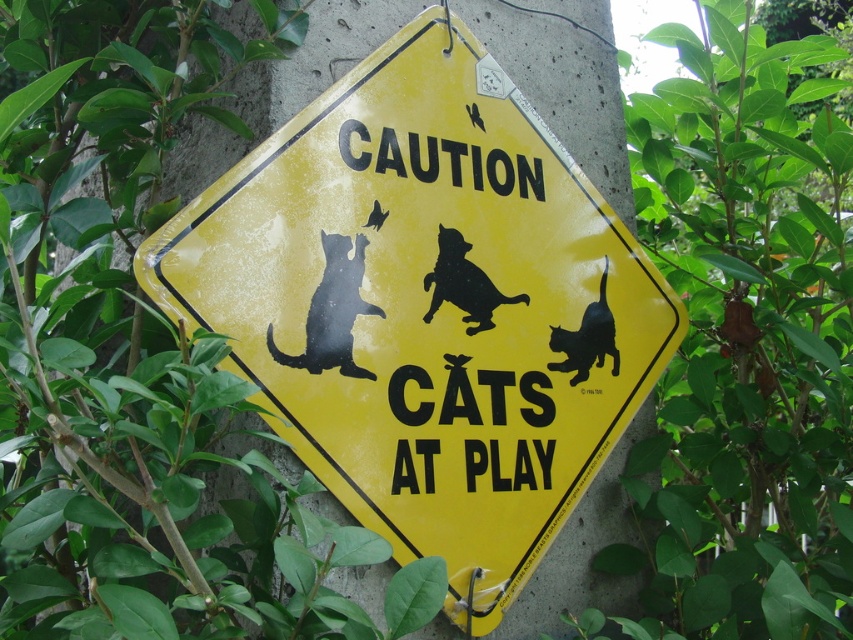
Find the location of a particular element. This screenshot has height=640, width=853. yellow plastic sign at center is located at coordinates (422, 307).

Which is behind, point (280, 200) or point (375, 305)?

Point (375, 305)

Find the location of `yellow plastic sign at center`. yellow plastic sign at center is located at coordinates (422, 307).

Does black matte cat at upper center come in front of black matte cat at lower right?

That is True.

The height and width of the screenshot is (640, 853). In order to click on black matte cat at upper center in this screenshot , I will do `click(332, 310)`.

Where is `black matte cat at upper center`? This screenshot has height=640, width=853. black matte cat at upper center is located at coordinates (332, 310).

Is yellow plastic sign at center taller than black matte cat at center?

Correct, yellow plastic sign at center is much taller as black matte cat at center.

Consider the image. Can you confirm if yellow plastic sign at center is shorter than black matte cat at center?

Incorrect, yellow plastic sign at center's height does not fall short of black matte cat at center's.

Does point (509, 600) come closer to viewer compared to point (450, 301)?

Yes.

The width and height of the screenshot is (853, 640). In order to click on yellow plastic sign at center in this screenshot , I will do `click(422, 307)`.